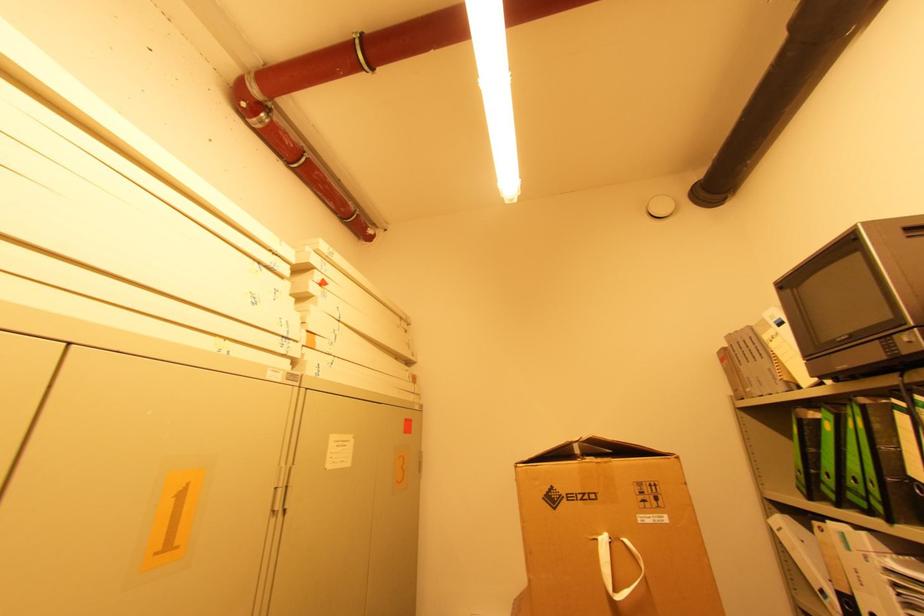
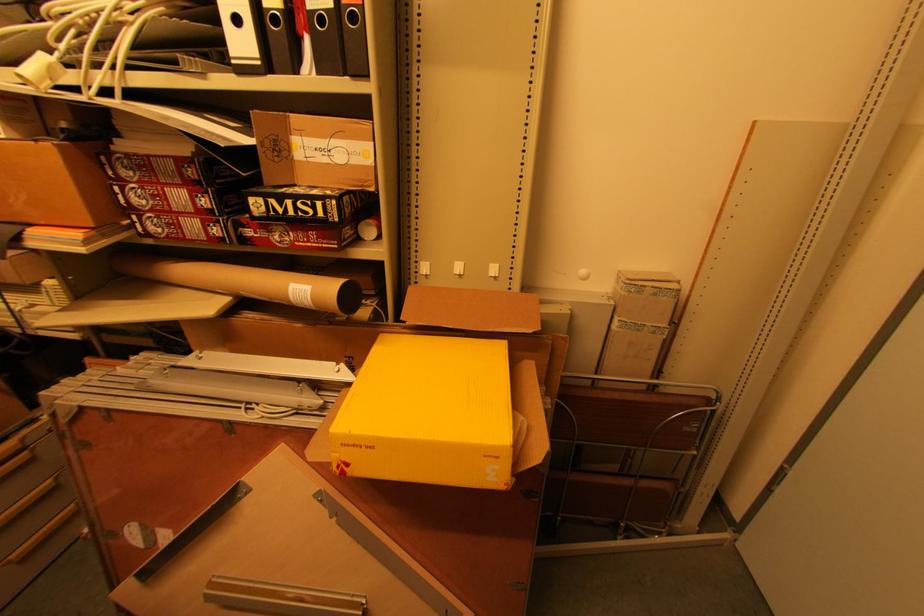
The first image is from the beginning of the video and the second image is from the end. How did the camera likely rotate when shooting the video?

The camera rotated toward right-down.